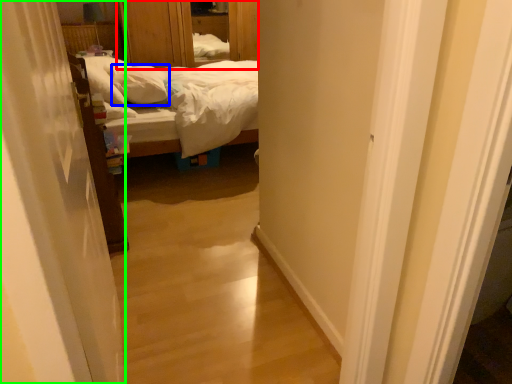
Question: Which object is the farthest from dresser (highlighted by a red box)? Choose among these: pillow (highlighted by a blue box) or curtain (highlighted by a green box).

Choices:
 (A) pillow
 (B) curtain

Answer: (B)